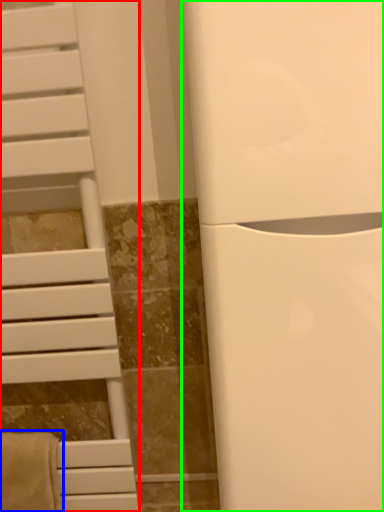
Question: Considering the real-world distances, which object is farthest from furniture (highlighted by a red box)? bath towel (highlighted by a blue box) or appliance (highlighted by a green box)?

Choices:
 (A) bath towel
 (B) appliance

Answer: (B)